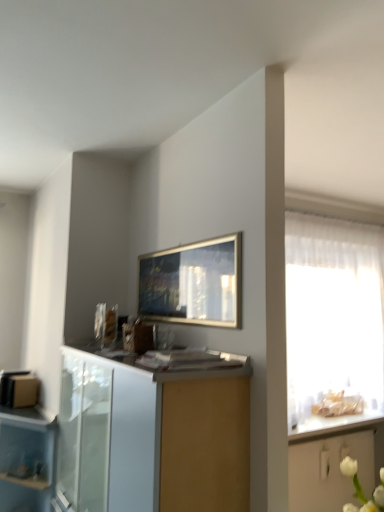
Question: Considering the relative sizes of transparent plastic drawer at lower left and white glossy cabinet at lower right, which appears as the second cabinetry when viewed from the left, in the image provided, is transparent plastic drawer at lower left shorter than white glossy cabinet at lower right, which appears as the second cabinetry when viewed from the left,?

Choices:
 (A) yes
 (B) no

Answer: (B)

Question: Does transparent plastic drawer at lower left turn towards white glossy cabinet at lower right, marked as the second cabinetry in a top-to-bottom arrangement?

Choices:
 (A) yes
 (B) no

Answer: (B)

Question: Does transparent plastic drawer at lower left lie behind white glossy cabinet at lower right, which ranks as the first cabinetry in right-to-left order?

Choices:
 (A) no
 (B) yes

Answer: (A)

Question: Is transparent plastic drawer at lower left wider than white glossy cabinet at lower right, the second cabinetry when ordered from front to back?

Choices:
 (A) no
 (B) yes

Answer: (B)

Question: From the image's perspective, is transparent plastic drawer at lower left over white glossy cabinet at lower right, marked as the second cabinetry in a top-to-bottom arrangement?

Choices:
 (A) no
 (B) yes

Answer: (B)

Question: Is white glossy cabinet at lower center, the second cabinetry from the bottom, to the left or to the right of white glossy countertop at right in the image?

Choices:
 (A) left
 (B) right

Answer: (A)

Question: Considering the positions of white glossy cabinet at lower center, the second cabinetry from the bottom, and white glossy countertop at right in the image, is white glossy cabinet at lower center, the second cabinetry from the bottom, wider or thinner than white glossy countertop at right?

Choices:
 (A) wide
 (B) thin

Answer: (B)

Question: Is white glossy cabinet at lower center, which appears as the 1th cabinetry when viewed from the front, in front of or behind white glossy countertop at right in the image?

Choices:
 (A) behind
 (B) front

Answer: (B)

Question: Considering the positions of white glossy cabinet at lower center, the 1th cabinetry in the left-to-right sequence, and white glossy countertop at right in the image, is white glossy cabinet at lower center, the 1th cabinetry in the left-to-right sequence, taller or shorter than white glossy countertop at right?

Choices:
 (A) short
 (B) tall

Answer: (B)

Question: From the image's perspective, is white glossy countertop at right above or below transparent plastic drawer at lower left?

Choices:
 (A) below
 (B) above

Answer: (B)

Question: Would you say white glossy countertop at right is inside or outside transparent plastic drawer at lower left?

Choices:
 (A) outside
 (B) inside

Answer: (A)

Question: Is white glossy countertop at right in front of or behind transparent plastic drawer at lower left in the image?

Choices:
 (A) behind
 (B) front

Answer: (A)

Question: Considering the positions of white glossy countertop at right and transparent plastic drawer at lower left in the image, is white glossy countertop at right wider or thinner than transparent plastic drawer at lower left?

Choices:
 (A) thin
 (B) wide

Answer: (B)

Question: Visually, is translucent fabric at right positioned to the left or to the right of white glossy countertop at right?

Choices:
 (A) left
 (B) right

Answer: (B)

Question: Choose the correct answer: Is translucent fabric at right inside white glossy countertop at right or outside it?

Choices:
 (A) outside
 (B) inside

Answer: (A)